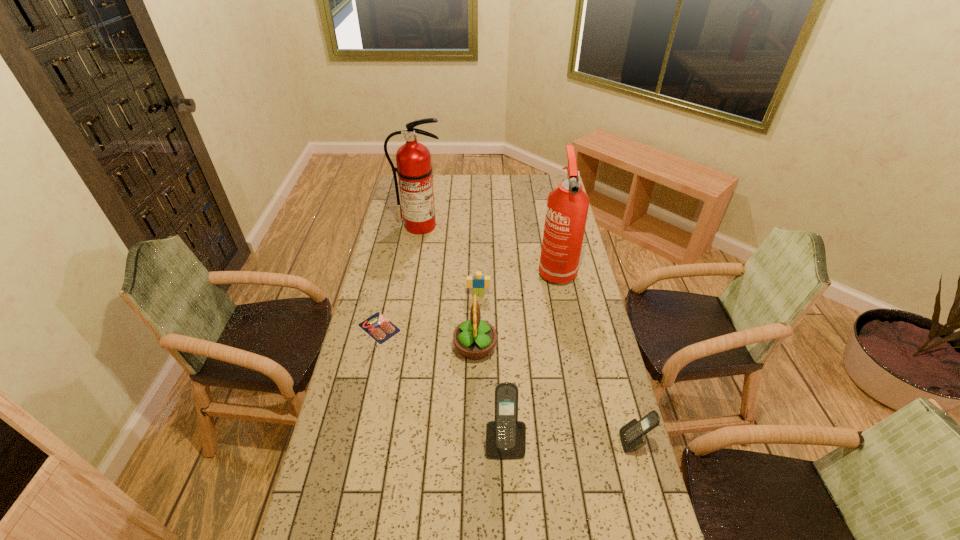
Locate an element on the screen. sunflower is located at coordinates (475, 338).

Find the location of a particular element. vacant region located 0.200m on the front-facing side of the left cellular telephone is located at coordinates (509, 535).

The image size is (960, 540). What are the coordinates of `free space located 0.100m on the front-facing side of the shorter cellular telephone` in the screenshot? It's located at coord(588,442).

Locate an element on the screen. free space located 0.350m on the front-facing side of the shorter cellular telephone is located at coordinates (505, 442).

The width and height of the screenshot is (960, 540). In order to click on vacant point located 0.270m on the front-facing side of the shorter cellular telephone in this screenshot , I will do `click(532, 442)`.

What are the coordinates of `vacant space situated 0.320m at the nozzle of the farther fire extinguisher` in the screenshot? It's located at (411, 280).

Locate an element on the screen. vacant space located 0.310m on the face of the second shortest object is located at coordinates (478, 358).

At what (x,y) coordinates should I click in order to perform the action: click on vacant space located 0.240m at the nozzle of the right fire extinguisher. Please return your answer as a coordinate pair (x, y). Image resolution: width=960 pixels, height=540 pixels. Looking at the image, I should click on (568, 330).

Find the location of `vacant region located on the back of the salami`. vacant region located on the back of the salami is located at coordinates (388, 289).

The width and height of the screenshot is (960, 540). Identify the location of vacant position located 0.180m on the face of the sunflower. (546, 348).